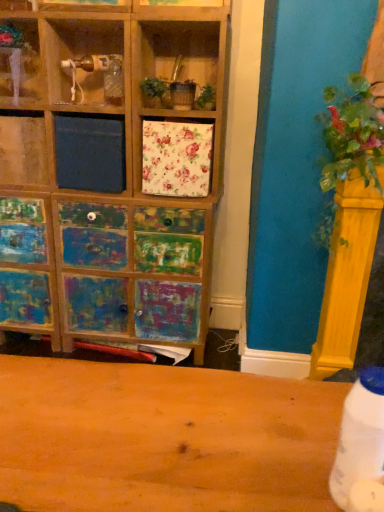
Identify the location of white plastic bottle at lower right. The height and width of the screenshot is (512, 384). (360, 436).

The image size is (384, 512). Describe the element at coordinates (351, 134) in the screenshot. I see `green leafy plant at right` at that location.

Locate an element on the screen. This screenshot has height=512, width=384. wooden shelf at upper left is located at coordinates (20, 61).

Can you tell me how much wooden shelf at upper left and green leafy plant at right differ in facing direction?

There is a 4.82-degree angle between the facing directions of wooden shelf at upper left and green leafy plant at right.

Could you tell me if wooden shelf at upper left is facing green leafy plant at right?

No, wooden shelf at upper left is not aimed at green leafy plant at right.

Between wooden shelf at upper left and green leafy plant at right, which one has larger width?

Wider between the two is green leafy plant at right.

Considering the relative positions of wooden shelf at upper left and green leafy plant at right in the image provided, is wooden shelf at upper left to the right of green leafy plant at right from the viewer's perspective?

In fact, wooden shelf at upper left is to the left of green leafy plant at right.

From a real-world perspective, is white plastic bottle at lower right positioned under wooden shelf at upper left based on gravity?

Yes, from a real-world perspective, white plastic bottle at lower right is below wooden shelf at upper left.

Is white plastic bottle at lower right outside of wooden shelf at upper left?

Absolutely, white plastic bottle at lower right is external to wooden shelf at upper left.

Is white plastic bottle at lower right behind wooden shelf at upper left?

No, white plastic bottle at lower right is in front of wooden shelf at upper left.

From the image's perspective, is white plastic bottle at lower right above or below wooden shelf at upper left?

white plastic bottle at lower right is below wooden shelf at upper left.

Who is smaller, green leafy plant at right or white plastic bottle at lower right?

white plastic bottle at lower right is smaller.

Can you confirm if green leafy plant at right is shorter than white plastic bottle at lower right?

No, green leafy plant at right is not shorter than white plastic bottle at lower right.

Which is behind, point (363, 115) or point (376, 473)?

The point (363, 115) is more distant.

From a real-world perspective, which is physically below, green leafy plant at right or white plastic bottle at lower right?

In real-world perspective, white plastic bottle at lower right is lower.

Is white plastic bottle at lower right situated inside green leafy plant at right or outside?

white plastic bottle at lower right is not enclosed by green leafy plant at right.

Where is `bottle in front of the green leafy plant at right`? Image resolution: width=384 pixels, height=512 pixels. bottle in front of the green leafy plant at right is located at coordinates (360, 436).

Based on the photo, considering the sizes of objects white plastic bottle at lower right and green leafy plant at right in the image provided, who is wider, white plastic bottle at lower right or green leafy plant at right?

With larger width is green leafy plant at right.

From a real-world perspective, is white plastic bottle at lower right positioned above or below green leafy plant at right?

In terms of real-world spatial position, white plastic bottle at lower right is below green leafy plant at right.

Looking at this image, from a real-world perspective, relative to wooden shelf at upper left, is green leafy plant at right vertically above or below?

From a real-world perspective, green leafy plant at right is physically below wooden shelf at upper left.

Is green leafy plant at right to the left or to the right of wooden shelf at upper left in the image?

Clearly, green leafy plant at right is on the right of wooden shelf at upper left in the image.

Is green leafy plant at right positioned far away from wooden shelf at upper left?

green leafy plant at right is far away from wooden shelf at upper left.

From the image's perspective, which object appears higher, green leafy plant at right or wooden shelf at upper left?

wooden shelf at upper left, from the image's perspective.

Is wooden shelf at upper left positioned far away from white plastic bottle at lower right?

Yes, wooden shelf at upper left is far from white plastic bottle at lower right.

In the scene shown: Is white plastic bottle at lower right inside wooden shelf at upper left?

Actually, white plastic bottle at lower right is outside wooden shelf at upper left.

From a real-world perspective, relative to white plastic bottle at lower right, is wooden shelf at upper left vertically above or below?

From a real-world perspective, wooden shelf at upper left is physically above white plastic bottle at lower right.

Which is in front, point (16, 55) or point (363, 419)?

The point (363, 419) is closer to the camera.

I want to click on shelf above the green leafy plant at right (from a real-world perspective), so click(x=20, y=61).

Find the location of a particular element. shelf above the white plastic bottle at lower right (from the image's perspective) is located at coordinates (20, 61).

When comparing their distances from wooden shelf at upper left, does white plastic bottle at lower right or green leafy plant at right seem further?

white plastic bottle at lower right is further to wooden shelf at upper left.

Considering their positions, is white plastic bottle at lower right positioned further to green leafy plant at right than wooden shelf at upper left?

wooden shelf at upper left is positioned further to the anchor green leafy plant at right.

When comparing their distances from white plastic bottle at lower right, does wooden shelf at upper left or green leafy plant at right seem closer?

green leafy plant at right is positioned closer to the anchor white plastic bottle at lower right.

Which object lies nearer to the anchor point white plastic bottle at lower right, green leafy plant at right or wooden shelf at upper left?

green leafy plant at right is positioned closer to the anchor white plastic bottle at lower right.

Based on their spatial positions, is green leafy plant at right or white plastic bottle at lower right closer to wooden shelf at upper left?

green leafy plant at right is positioned closer to the anchor wooden shelf at upper left.

Estimate the real-world distances between objects in this image. Which object is closer to green leafy plant at right, wooden shelf at upper left or white plastic bottle at lower right?

white plastic bottle at lower right is positioned closer to the anchor green leafy plant at right.

Where is `bottle between wooden shelf at upper left and green leafy plant at right in the horizontal direction`? bottle between wooden shelf at upper left and green leafy plant at right in the horizontal direction is located at coordinates (360, 436).